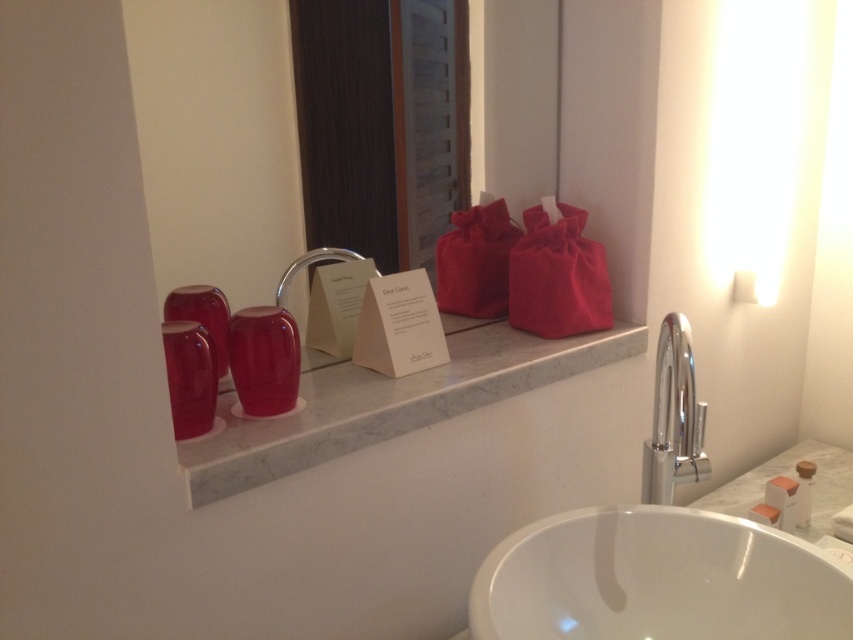
Does glossy plastic toiletries at center lie in front of translucent plastic soap at lower right?

Yes, it is in front of translucent plastic soap at lower right.

Can you confirm if glossy plastic toiletries at center is thinner than translucent plastic soap at lower right?

In fact, glossy plastic toiletries at center might be wider than translucent plastic soap at lower right.

Describe the element at coordinates (263, 358) in the screenshot. Image resolution: width=853 pixels, height=640 pixels. I see `glossy plastic toiletries at center` at that location.

This screenshot has height=640, width=853. In order to click on glossy plastic toiletries at center in this screenshot , I will do `click(263, 358)`.

From the picture: Can you confirm if matte glass mirror at upper center is shorter than translucent plastic soap at lower right?

Incorrect, matte glass mirror at upper center's height does not fall short of translucent plastic soap at lower right's.

Is point (550, 180) behind point (810, 500)?

Yes, point (550, 180) is behind point (810, 500).

Between point (184, 131) and point (795, 524), which one is positioned behind?

The point (795, 524) is more distant.

In order to click on matte glass mirror at upper center in this screenshot , I will do [x=216, y=141].

In the scene shown: Is white marble ledge at upper center above glossy plastic toiletries at center?

Actually, white marble ledge at upper center is below glossy plastic toiletries at center.

Does white marble ledge at upper center have a larger size compared to glossy plastic toiletries at center?

Yes.

Identify the location of white marble ledge at upper center. The height and width of the screenshot is (640, 853). (386, 403).